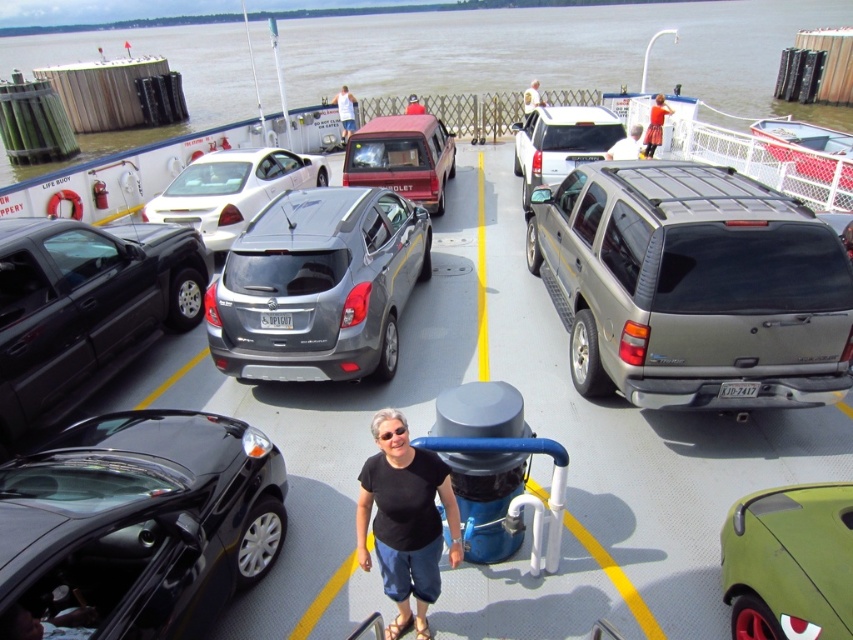
Question: Which object appears farthest from the camera in this image?

Choices:
 (A) white glossy car at upper left
 (B) red fabric shirt at center

Answer: (B)

Question: Is shiny black car at lower left positioned before satin silver suv at center?

Choices:
 (A) no
 (B) yes

Answer: (B)

Question: In this image, where is satin silver suv at center located relative to satin black minivan at left?

Choices:
 (A) above
 (B) below

Answer: (A)

Question: Does green matte car at lower right appear on the right side of matte red minivan at center?

Choices:
 (A) no
 (B) yes

Answer: (B)

Question: Among these objects, which one is farthest from the camera?

Choices:
 (A) silver metallic minivan at center
 (B) matte red minivan at center
 (C) light blue shirt at center
 (D) green matte car at lower right

Answer: (C)

Question: Considering the real-world distances, which object is closest to the orange skirt at upper right?

Choices:
 (A) shiny black car at lower left
 (B) satin silver suv at center

Answer: (B)